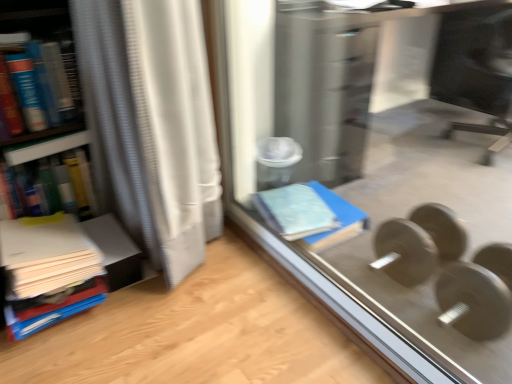
I want to click on free space behind matte gray dumbbell at lower right, arranged as the 2th dumbbell when viewed from the back, so click(x=458, y=251).